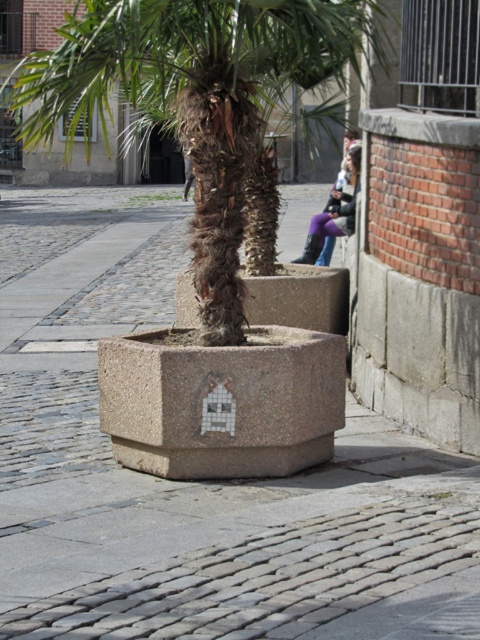
You are a city planner reviewing a street layout. You notice the gray concrete planter at center and the green leafy palm tree at center. Which object is positioned more to the east if the street runs north to south?

The gray concrete planter at center is to the right of the green leafy palm tree at center. Assuming the street runs north to south, the right side would correspond to the east direction. Therefore, the gray concrete planter at center is positioned more to the east.

You are standing on the cobblestone street and want to take a photo of the green leafy palm tree at center. If you move 0.05 units to the right along the x and y axes, will you still be able to see the entire palm tree in your view?

The green leafy palm tree at center is located at point (195, 99). Moving 0.05 units to the right along both the x and y axes would position you at approximately (219, 131). Since the palm tree is centrally positioned, this slight shift might still keep it within your view, but the exact visibility depends on the field of view of your camera. However, based on the coordinates alone, the tree remains in the frame as the shift is minimal.